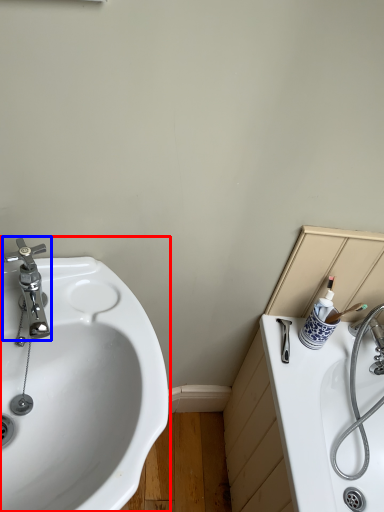
Question: Which object appears farthest to the camera in this image, sink (highlighted by a red box) or tap (highlighted by a blue box)?

Choices:
 (A) sink
 (B) tap

Answer: (B)